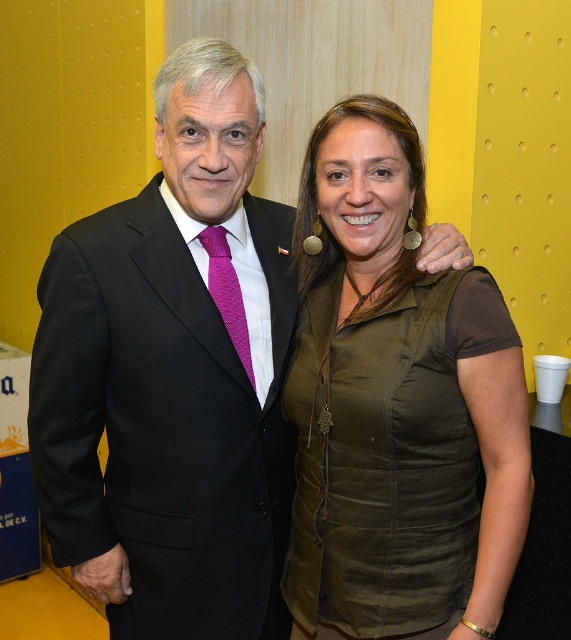
Is green textured vest at center above purple textured tie at center?

No, green textured vest at center is not above purple textured tie at center.

Is point (486, 296) more distant than point (227, 269)?

No.

Who is more distant from viewer, (384,136) or (238,280)?

Point (238,280)

Where is `green textured vest at center`? green textured vest at center is located at coordinates (396, 404).

Does green textured vest at center come in front of black wool suit at center?

Yes.

Between green textured vest at center and black wool suit at center, which one is positioned higher?

green textured vest at center is above.

Which is in front, point (379, 381) or point (160, 413)?

Positioned in front is point (379, 381).

The height and width of the screenshot is (640, 571). I want to click on green textured vest at center, so click(396, 404).

Which is below, black wool suit at center or purple textured tie at center?

Positioned lower is black wool suit at center.

Between point (82, 332) and point (235, 324), which one is positioned behind?

The point (235, 324) is more distant.

Find the location of a particular element. The width and height of the screenshot is (571, 640). black wool suit at center is located at coordinates (163, 422).